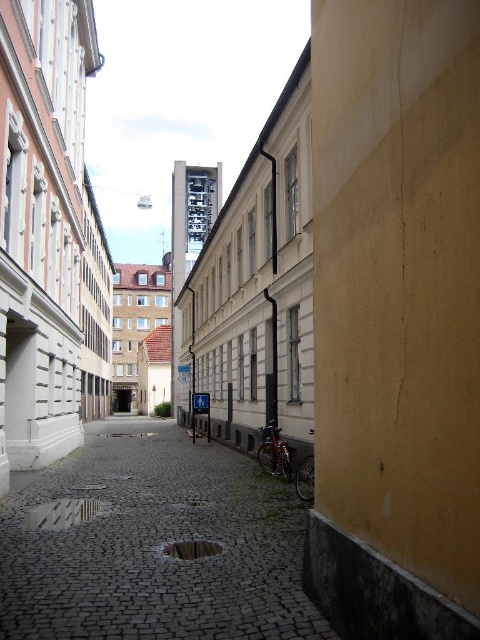
Question: Is cobblestone alley at center to the left of reflective cobblestone puddle at center from the viewer's perspective?

Choices:
 (A) yes
 (B) no

Answer: (B)

Question: Does cobblestone alley at center have a smaller size compared to reflective cobblestone puddle at center?

Choices:
 (A) yes
 (B) no

Answer: (B)

Question: Based on their relative distances, which object is farther from the glossy concrete puddle at center?

Choices:
 (A) cobblestone alley at center
 (B) reflective cobblestone puddle at center

Answer: (A)

Question: Which point appears farthest from the camera in this image?

Choices:
 (A) pyautogui.click(x=179, y=557)
 (B) pyautogui.click(x=63, y=522)

Answer: (B)

Question: Can you confirm if cobblestone alley at center is positioned to the left of glossy concrete puddle at center?

Choices:
 (A) no
 (B) yes

Answer: (B)

Question: Estimate the real-world distances between objects in this image. Which object is closer to the reflective cobblestone puddle at center?

Choices:
 (A) glossy concrete puddle at center
 (B) cobblestone alley at center

Answer: (B)